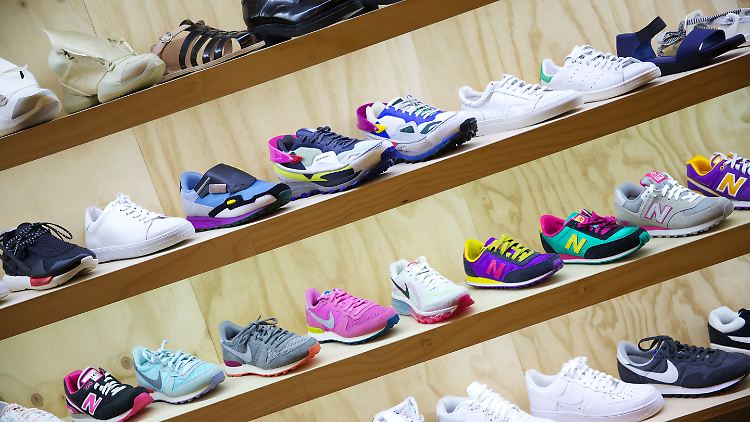
This screenshot has width=750, height=422. I want to click on shoes on top shelf, so coord(36,106), coord(124,65), coord(195,46), coord(289,18).